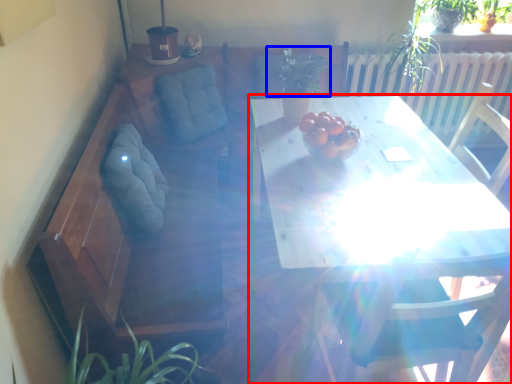
Question: Which of the following is the closest to the observer, table (highlighted by a red box) or plant (highlighted by a blue box)?

Choices:
 (A) table
 (B) plant

Answer: (A)